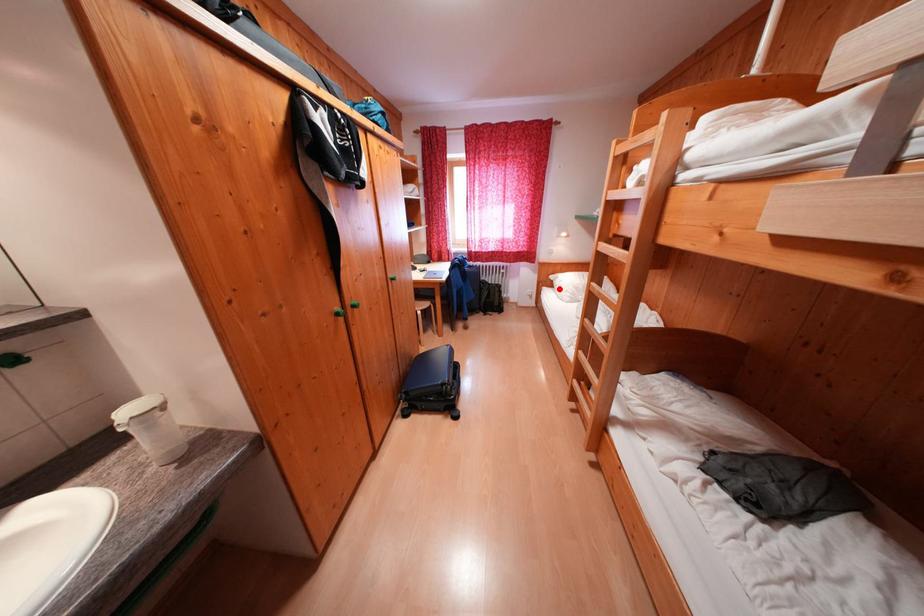
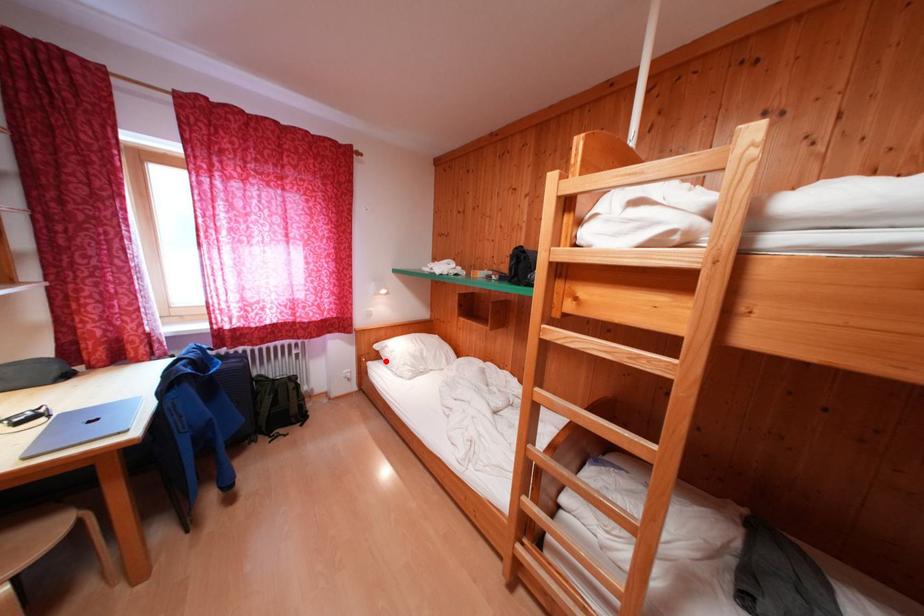
I am providing you with two images of the same scene from different viewpoints. A red point is marked on the first image and another point is marked on the second image. Are the points marked in image1 and image2 representing the same 3D position?

Yes